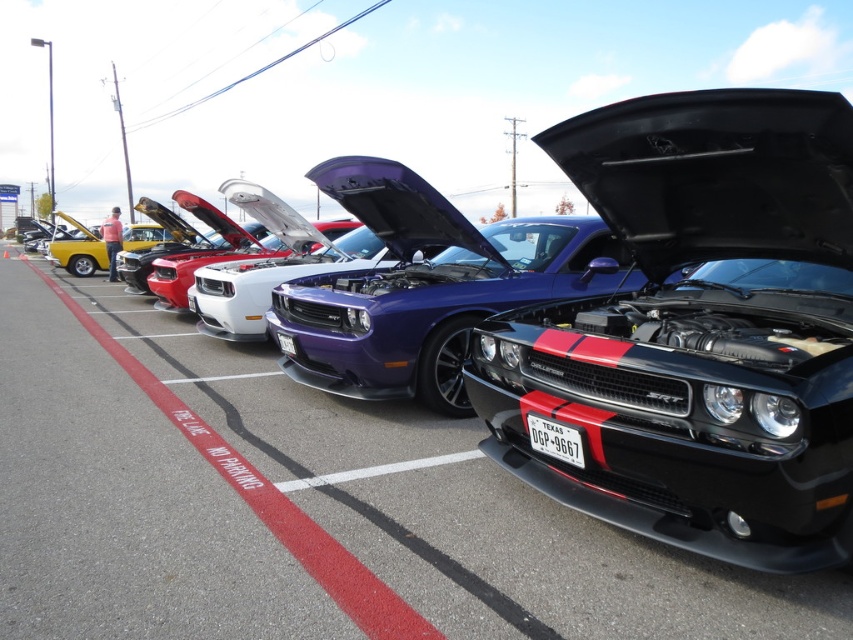
You are a parking attendant who needs to fit both the shiny purple car at center and the metallic yellow car at left into a single parking spot that can accommodate a car up to 1.8 meters in width. Which car should you prioritize to ensure it fits?

The shiny purple car at center has a lesser width compared to metallic yellow car at left. Since the parking spot can only accommodate up to 1.8 meters, the shiny purple car at center is more likely to fit, while the metallic yellow car at left may exceed the width limit.

You are standing in the parking lot and want to reach a specific point marked at coordinates point (608,264). If you can walk 1.5 meters per second, how long will it take you to reach that point?

The distance of point (608,264) from camera is 4.33 meters. At a walking speed of 1.5 meters per second, it would take approximately 2.89 seconds to reach the point.

You are standing at the entrance of the parking lot and want to find the black matte car at center. According to the coordinates provided, in which direction should you walk to reach it?

The black matte car at center is located at coordinates point (x=695, y=332). Since the y coordinate is 0.817, which is closer to 1, you should walk forward towards the back of the parking lot to reach it.